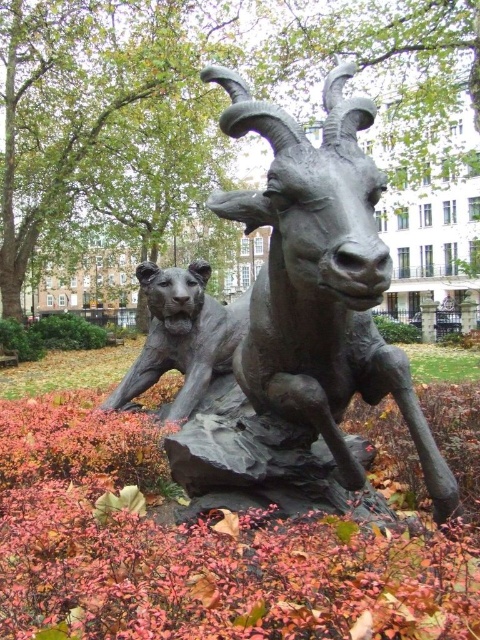
Question: Does bronze textured goat at center lie behind shiny bronze tiger at center?

Choices:
 (A) yes
 (B) no

Answer: (B)

Question: Which point appears closest to the camera in this image?

Choices:
 (A) [x=368, y=291]
 (B) [x=171, y=337]

Answer: (A)

Question: Among these points, which one is farthest from the camera?

Choices:
 (A) (347, 272)
 (B) (134, 362)
 (C) (44, 413)

Answer: (B)

Question: Can you confirm if bronze statue at center is bigger than shiny bronze tiger at center?

Choices:
 (A) no
 (B) yes

Answer: (B)

Question: Does bronze statue at center lie in front of bronze textured goat at center?

Choices:
 (A) no
 (B) yes

Answer: (B)

Question: Which is nearer to the bronze statue at center?

Choices:
 (A) bronze textured goat at center
 (B) shiny bronze tiger at center

Answer: (A)